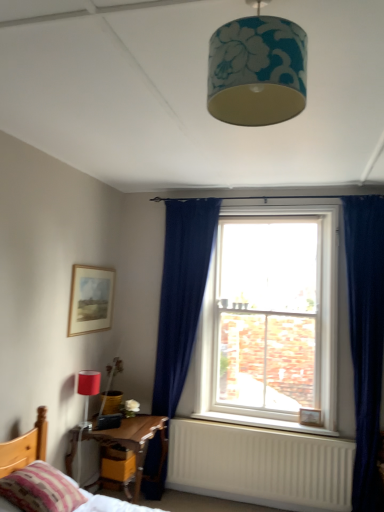
The image size is (384, 512). What are the coordinates of `unoccupied region to the right of matte red lampshade at lower left, which is counted as the first lamp, starting from the back` in the screenshot? It's located at (112, 429).